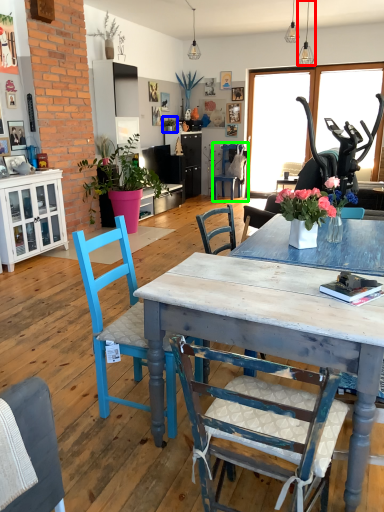
Question: Considering the real-world distances, which object is closest to lamp (highlighted by a red box)? houseplant (highlighted by a blue box) or chair (highlighted by a green box).

Choices:
 (A) houseplant
 (B) chair

Answer: (B)